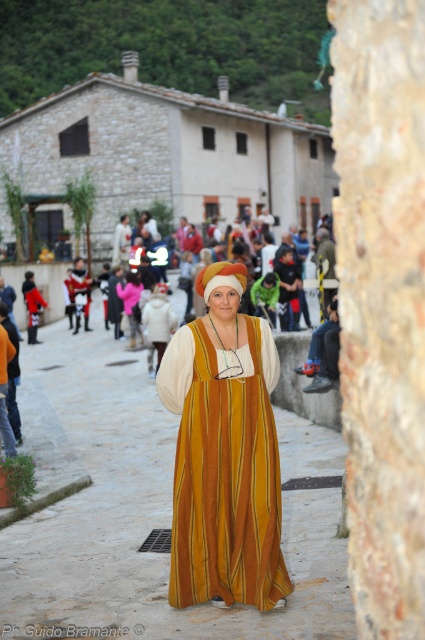
Based on the scene description, where exactly is the velvet yellow dress at center located in terms of coordinates?

Result: The velvet yellow dress at center is located at coordinates point [223,454].